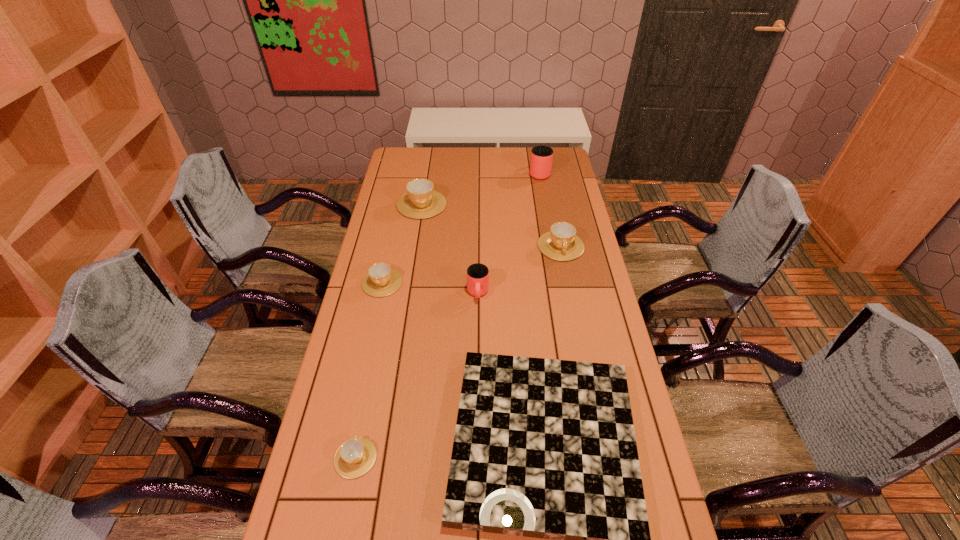
You are a GUI agent. You are given a task and a screenshot of the screen. Output one action in this format:
    pyautogui.click(x=<x>, y=<y>)
    Task: Click on the free space at the right edge
    Image resolution: width=960 pixels, height=540 pixels.
    Given the screenshot: What is the action you would take?
    pyautogui.click(x=591, y=260)

Image resolution: width=960 pixels, height=540 pixels. In order to click on free spot at the far left corner of the desktop in this screenshot , I will do `click(420, 159)`.

Where is `free area in between the smallest brown cup and the tallest cup`? free area in between the smallest brown cup and the tallest cup is located at coordinates (447, 315).

Where is `empty space that is in between the third farthest brown cup and the shortest cup`? The image size is (960, 540). empty space that is in between the third farthest brown cup and the shortest cup is located at coordinates (369, 370).

Where is `empty space between the fifth tallest object and the farthest brown cup`? This screenshot has width=960, height=540. empty space between the fifth tallest object and the farthest brown cup is located at coordinates 402,244.

Choose which object is the third nearest neighbor to the fourth cup from left to right. Please provide its 2D coordinates. Your answer should be formatted as a tuple, i.e. [(x, y)], where the tuple contains the x and y coordinates of a point satisfying the conditions above.

[(381, 280)]

Locate which object ranks third in proximity to the right pink cup. Please provide its 2D coordinates. Your answer should be formatted as a tuple, i.e. [(x, y)], where the tuple contains the x and y coordinates of a point satisfying the conditions above.

[(477, 274)]

Locate which cup ranks fifth in proximity to the nearest cup. Please provide its 2D coordinates. Your answer should be formatted as a tuple, i.e. [(x, y)], where the tuple contains the x and y coordinates of a point satisfying the conditions above.

[(541, 159)]

Where is `cup that can be found as the fourth closest to the third biggest brown cup`? Image resolution: width=960 pixels, height=540 pixels. cup that can be found as the fourth closest to the third biggest brown cup is located at coordinates (561, 243).

The height and width of the screenshot is (540, 960). Identify the location of brown cup that is the third closest to the bigger pink cup. (381, 280).